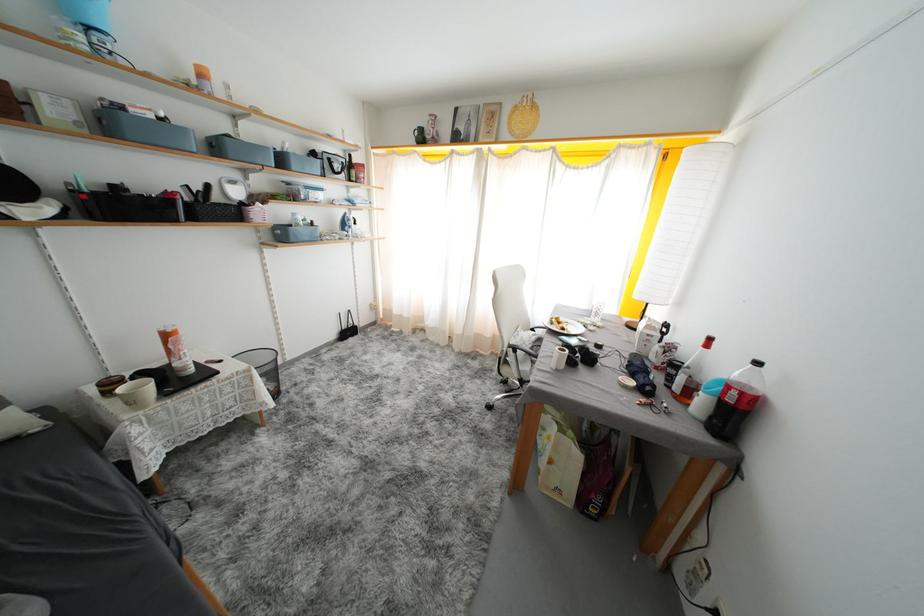
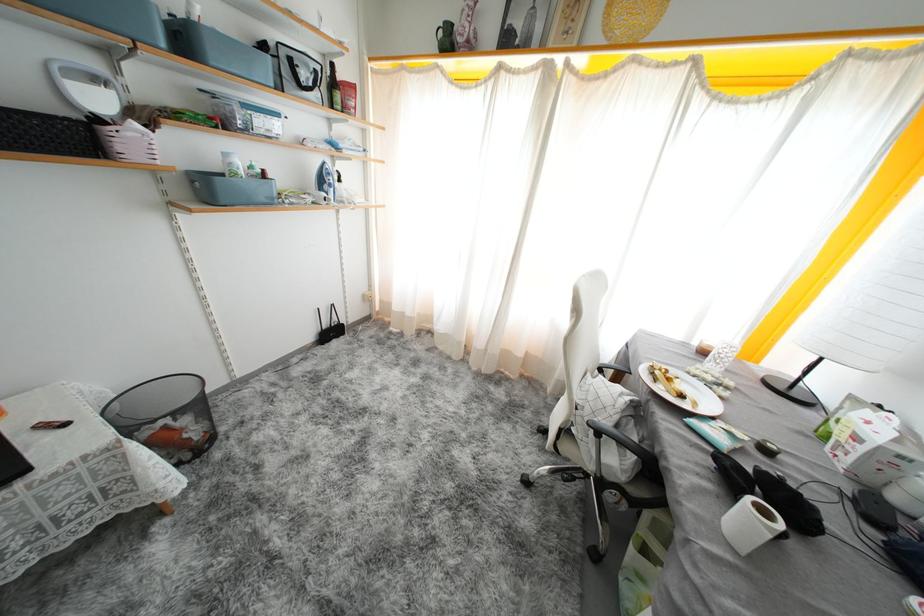
Locate, in the second image, the point that corresponds to point 567,347 in the first image.

(716, 454)